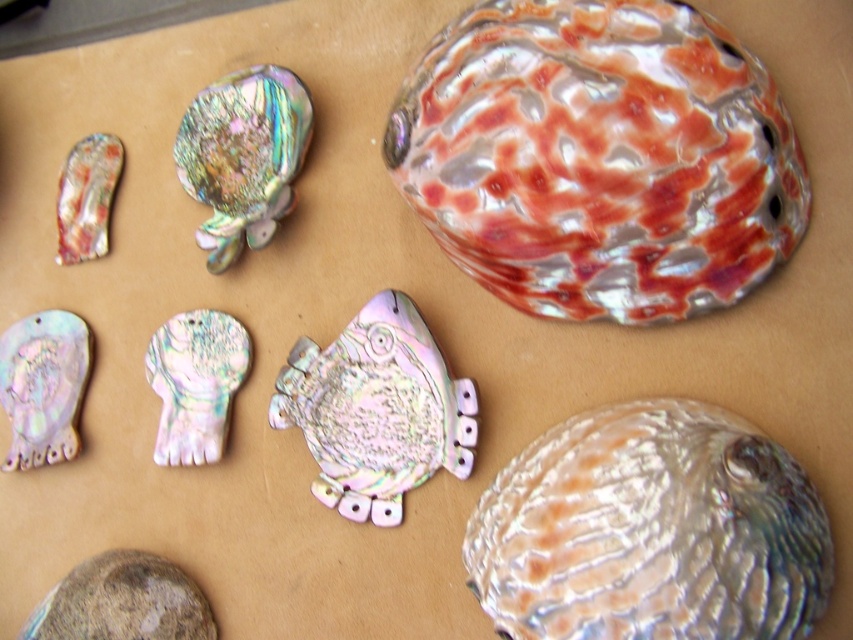
You are organizing seashells on a table and see two iridescent shells. One is labeled as the iridescent shell at upper left and the other as the iridescent shell at left. Which of these two shells is positioned more to the right side of the table?

Result: The iridescent shell at upper left is positioned more to the right compared to the iridescent shell at left.

You are standing in front of the seashell arrangement. There are two points marked on the image at coordinates point (219, 244) and point (57, 252). Which point is closer to you?

Point (219, 244) is closer to the camera than point (57, 252).